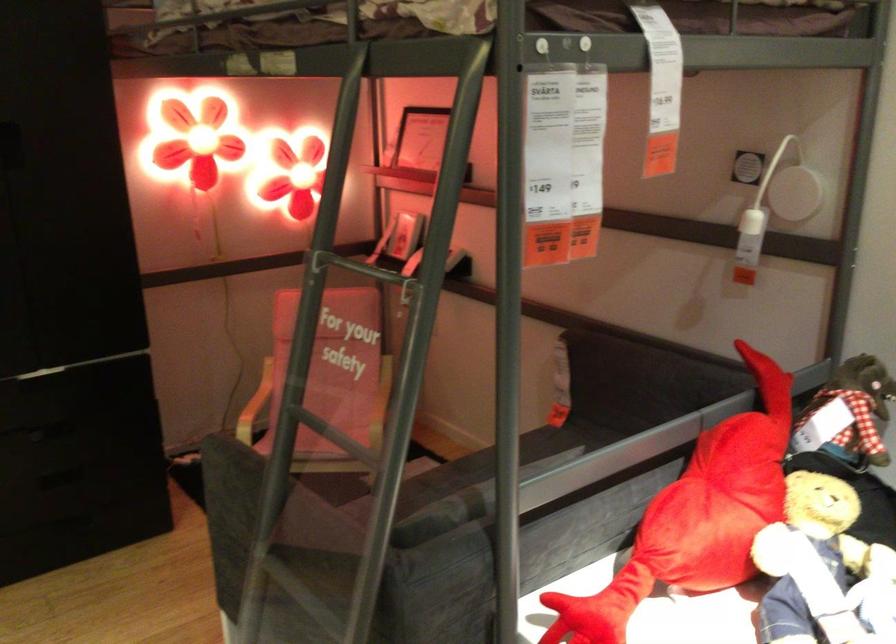
Where is `wooden chair armrest`? This screenshot has width=896, height=644. wooden chair armrest is located at coordinates (252, 406).